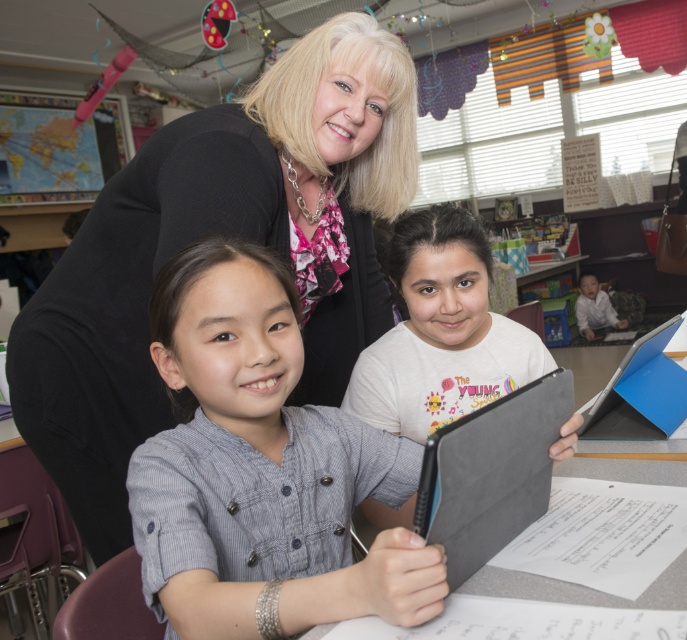
Consider the image. Who is lower down, black fabric at upper center or matte gray tablet at center?

matte gray tablet at center is lower down.

Is black fabric at upper center above matte gray tablet at center?

Correct, black fabric at upper center is located above matte gray tablet at center.

The height and width of the screenshot is (640, 687). In order to click on black fabric at upper center in this screenshot , I will do `click(221, 234)`.

Does point (337, 474) come closer to viewer compared to point (473, 582)?

No, (337, 474) is further to viewer.

Which is above, gray button-down shirt at center or gray matte tablet at center?

gray button-down shirt at center

Which is behind, point (236, 260) or point (559, 588)?

Point (236, 260)

Locate an element on the screen. gray button-down shirt at center is located at coordinates (260, 468).

Can you confirm if black fabric at upper center is positioned to the left of gray matte tablet at center?

Yes, black fabric at upper center is to the left of gray matte tablet at center.

Between black fabric at upper center and gray matte tablet at center, which one is positioned higher?

black fabric at upper center

Is point (177, 212) behind point (594, 602)?

That is True.

What are the coordinates of `black fabric at upper center` in the screenshot? It's located at (221, 234).